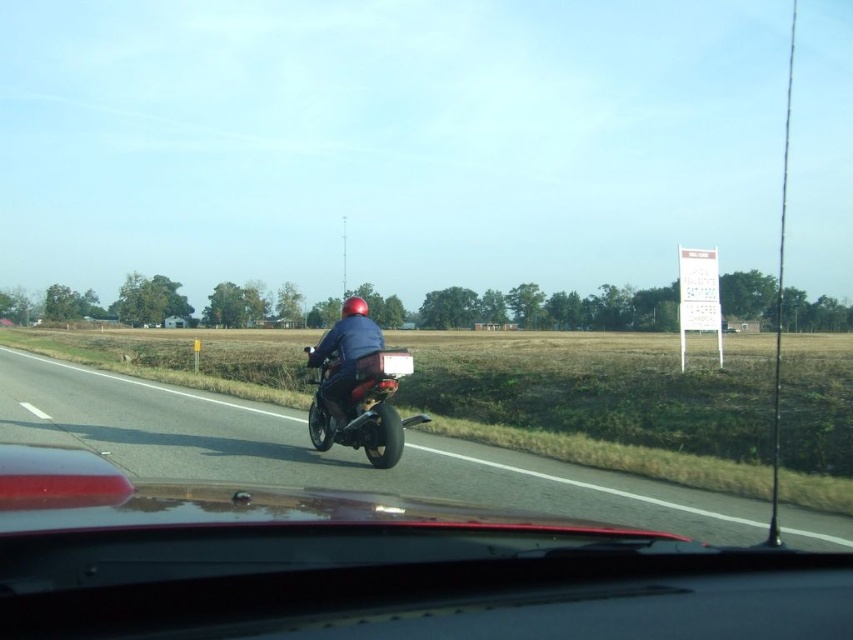
Does glossy red motorcycle at center appear under shiny black motorcycle at center?

Correct, glossy red motorcycle at center is located below shiny black motorcycle at center.

Is point (48, 508) positioned in front of point (344, 344)?

Yes.

Where is `glossy red motorcycle at center`? This screenshot has height=640, width=853. glossy red motorcycle at center is located at coordinates (368, 566).

Who is positioned more to the left, shiny black motorcycle at center or matte blue jacket at center?

shiny black motorcycle at center

I want to click on shiny black motorcycle at center, so click(358, 387).

Between point (289, 468) and point (326, 332), which one is positioned in front?

Point (289, 468) is more forward.

Can you confirm if black rubber motorcycle at center is taller than matte blue jacket at center?

In fact, black rubber motorcycle at center may be shorter than matte blue jacket at center.

This screenshot has width=853, height=640. I want to click on black rubber motorcycle at center, so click(x=328, y=452).

Locate an element on the screen. black rubber motorcycle at center is located at coordinates (328, 452).